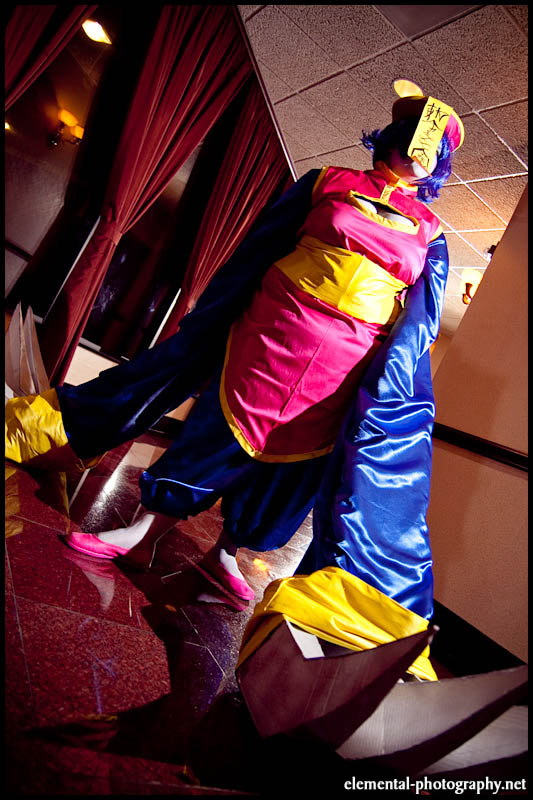
Where is `drapes`? The width and height of the screenshot is (533, 800). drapes is located at coordinates (184, 98), (273, 160).